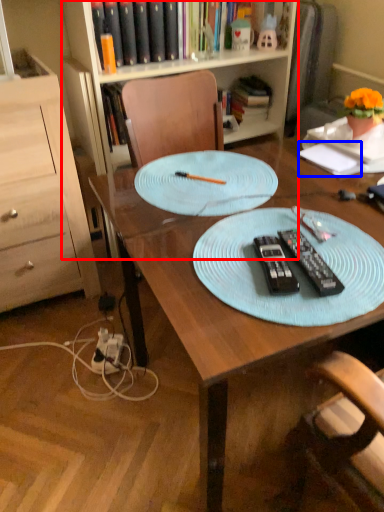
Question: Which point is closer to the camera, bookcase (highlighted by a red box) or notepad (highlighted by a blue box)?

Choices:
 (A) bookcase
 (B) notepad

Answer: (B)